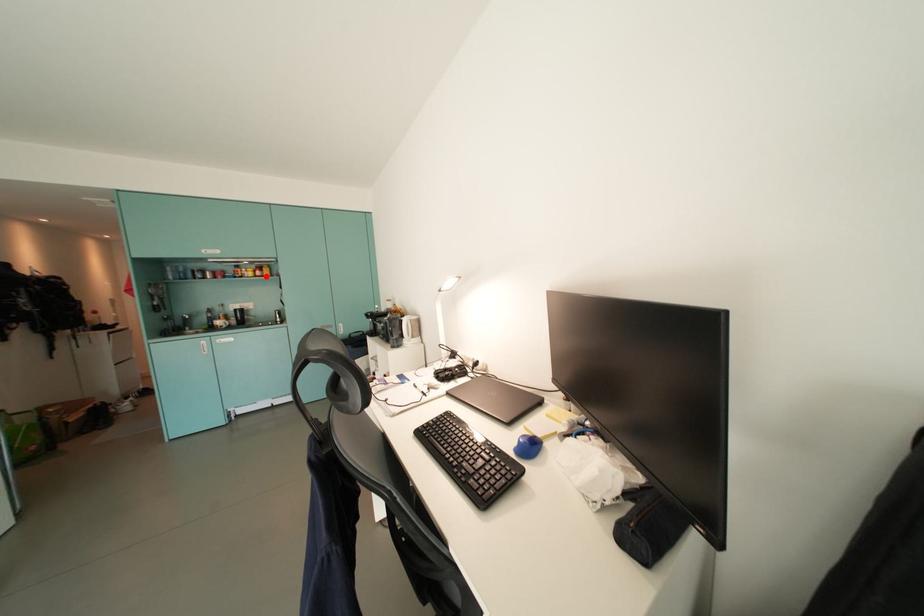
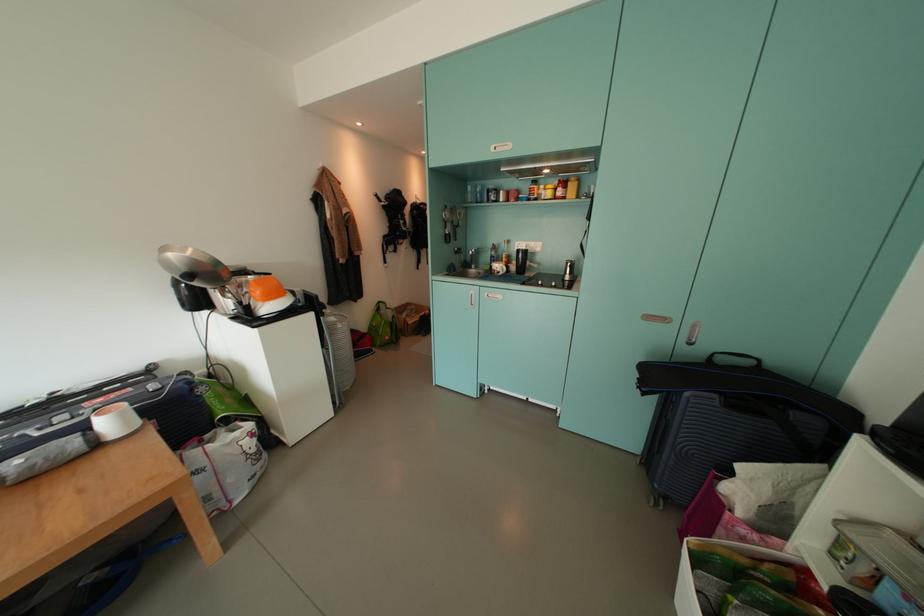
Question: I am providing you with two images of the same scene from different viewpoints. In image1, a red point is highlighted. Considering the same 3D point in image2, which of the following is correct?

Choices:
 (A) It is closer
 (B) It is farther

Answer: (A)